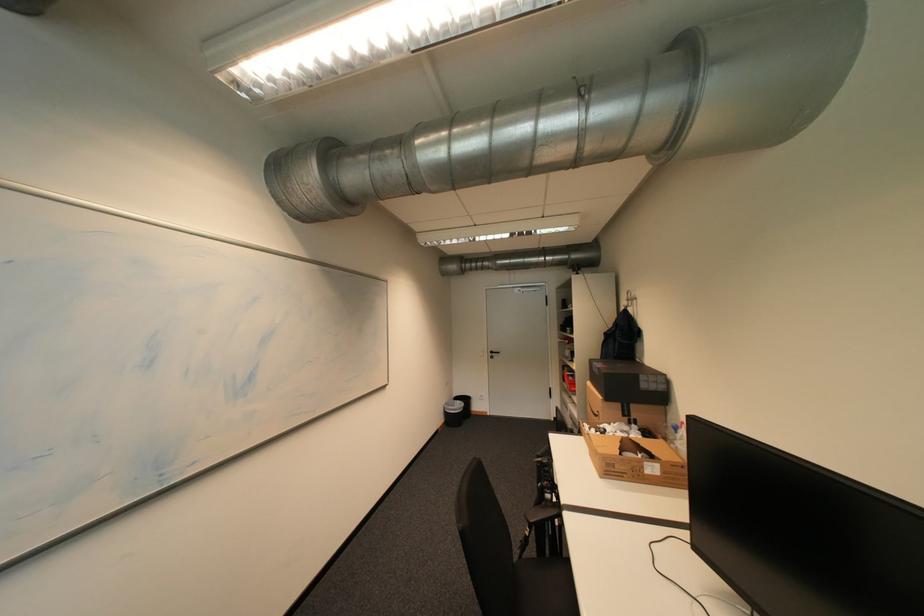
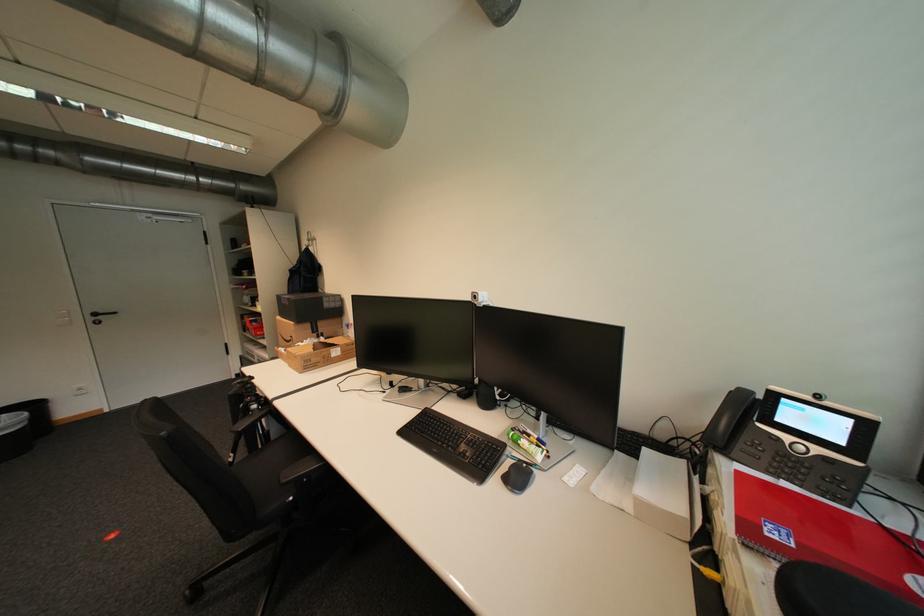
Question: The first image is from the beginning of the video and the second image is from the end. How did the camera likely rotate when shooting the video?

Choices:
 (A) Left
 (B) Right
 (C) Up
 (D) Down

Answer: (B)